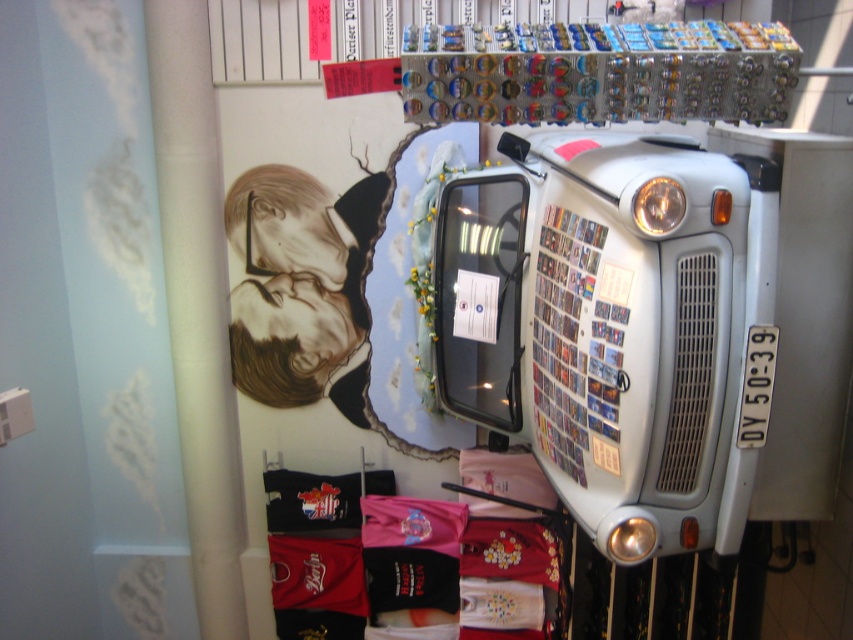
Can you confirm if light gray metallic truck at center is positioned above white matte pillar at left?

Yes, light gray metallic truck at center is above white matte pillar at left.

Can you confirm if light gray metallic truck at center is wider than white matte pillar at left?

Yes, light gray metallic truck at center is wider than white matte pillar at left.

Find the location of a particular element. light gray metallic truck at center is located at coordinates (656, 324).